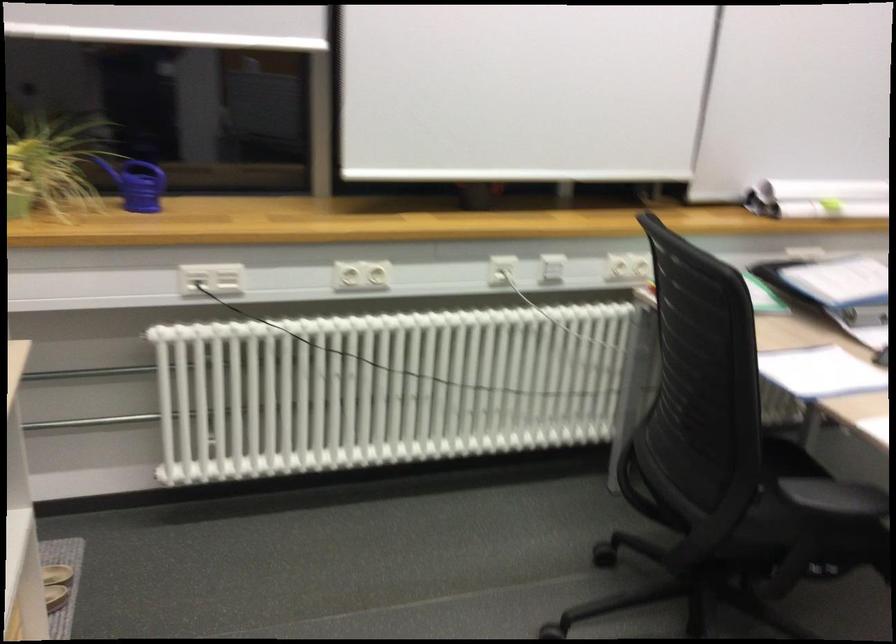
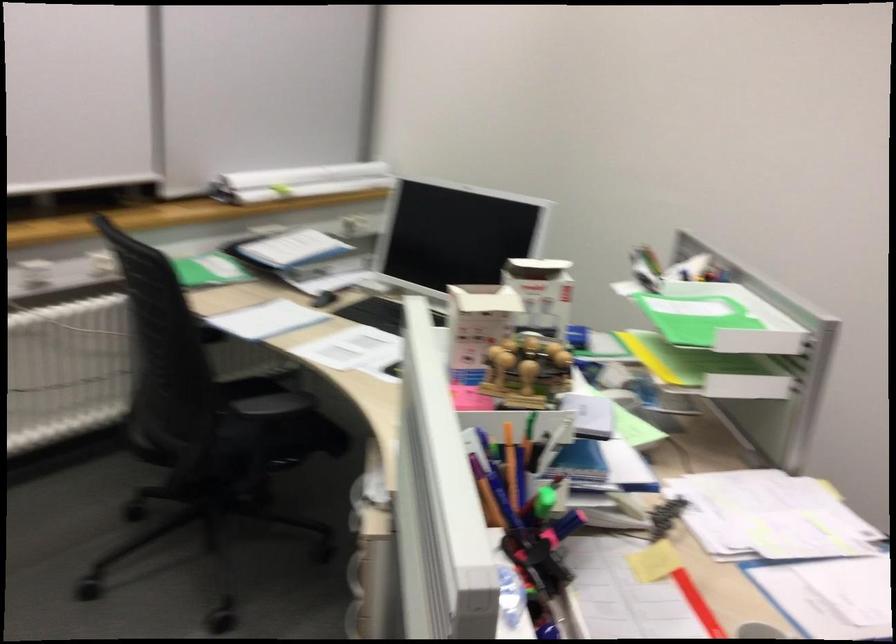
Question: The images are taken continuously from a first-person perspective. In which direction is your viewpoint rotating?

Choices:
 (A) Left
 (B) Right
 (C) Up
 (D) Down

Answer: (B)